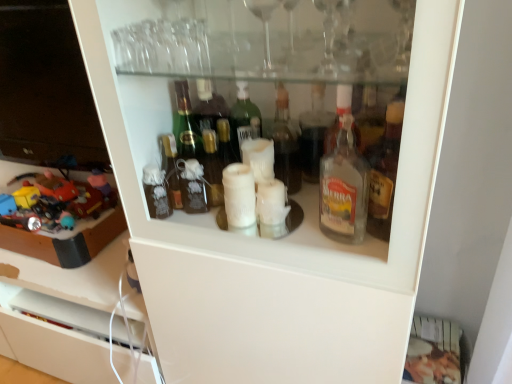
Describe the element at coordinates (61, 202) in the screenshot. I see `plastic toys at left, arranged as the first toy when viewed from the left` at that location.

You are a GUI agent. You are given a task and a screenshot of the screen. Output one action in this format:
    pyautogui.click(x=<x>, y=<y>)
    Task: Click on the plastic toys at left, positioned as the second toy in right-to-left order
    
    Given the screenshot: What is the action you would take?
    pyautogui.click(x=61, y=202)

You are a GUI agent. You are given a task and a screenshot of the screen. Output one action in this format:
    pyautogui.click(x=<x>, y=<y>)
    Task: Click on the plastic toy car at left, the 2th toy viewed from the left
    
    Given the screenshot: What is the action you would take?
    pyautogui.click(x=56, y=187)

The width and height of the screenshot is (512, 384). Describe the element at coordinates (56, 187) in the screenshot. I see `plastic toy car at left, placed as the first toy when sorted from right to left` at that location.

Image resolution: width=512 pixels, height=384 pixels. Find the location of `plastic toys at left, arranged as the first toy when viewed from the left`. plastic toys at left, arranged as the first toy when viewed from the left is located at coordinates (61, 202).

Can you confirm if plastic toy car at left, the 2th toy viewed from the left, is positioned to the right of plastic toys at left, arranged as the first toy when viewed from the left?

Yes, plastic toy car at left, the 2th toy viewed from the left, is to the right of plastic toys at left, arranged as the first toy when viewed from the left.

Is plastic toy car at left, the 2th toy viewed from the left, further to camera compared to plastic toys at left, positioned as the second toy in right-to-left order?

That is True.

Does point (49, 176) come behind point (79, 205)?

Yes, point (49, 176) is farther from viewer.

From the image's perspective, is plastic toy car at left, the 2th toy viewed from the left, above plastic toys at left, arranged as the first toy when viewed from the left?

Yes.

From a real-world perspective, is plastic toy car at left, placed as the first toy when sorted from right to left, under plastic toys at left, arranged as the first toy when viewed from the left?

No.

In terms of width, does plastic toy car at left, the 2th toy viewed from the left, look wider or thinner when compared to plastic toys at left, arranged as the first toy when viewed from the left?

In the image, plastic toy car at left, the 2th toy viewed from the left, appears to be more narrow than plastic toys at left, arranged as the first toy when viewed from the left.

Between plastic toy car at left, placed as the first toy when sorted from right to left, and plastic toys at left, arranged as the first toy when viewed from the left, which one has more height?

With more height is plastic toys at left, arranged as the first toy when viewed from the left.

Considering the sizes of plastic toy car at left, placed as the first toy when sorted from right to left, and plastic toys at left, positioned as the second toy in right-to-left order, in the image, is plastic toy car at left, placed as the first toy when sorted from right to left, bigger or smaller than plastic toys at left, positioned as the second toy in right-to-left order,?

Clearly, plastic toy car at left, placed as the first toy when sorted from right to left, is smaller in size than plastic toys at left, positioned as the second toy in right-to-left order.

Is plastic toy car at left, the 2th toy viewed from the left, completely or partially outside of plastic toys at left, positioned as the second toy in right-to-left order?

No, plastic toy car at left, the 2th toy viewed from the left, is not outside of plastic toys at left, positioned as the second toy in right-to-left order.

Is plastic toy car at left, placed as the first toy when sorted from right to left, beside plastic toys at left, positioned as the second toy in right-to-left order?

Yes, plastic toy car at left, placed as the first toy when sorted from right to left, is touching plastic toys at left, positioned as the second toy in right-to-left order.

Is plastic toy car at left, placed as the first toy when sorted from right to left, turned away from plastic toys at left, arranged as the first toy when viewed from the left?

No, plastic toys at left, arranged as the first toy when viewed from the left, is not at the back of plastic toy car at left, placed as the first toy when sorted from right to left.

Locate an element on the screen. toy below the plastic toy car at left, placed as the first toy when sorted from right to left (from the image's perspective) is located at coordinates coord(61,202).

Considering the positions of objects plastic toys at left, positioned as the second toy in right-to-left order, and plastic toy car at left, placed as the first toy when sorted from right to left, in the image provided, who is more to the right, plastic toys at left, positioned as the second toy in right-to-left order, or plastic toy car at left, placed as the first toy when sorted from right to left,?

From the viewer's perspective, plastic toy car at left, placed as the first toy when sorted from right to left, appears more on the right side.

Relative to plastic toy car at left, the 2th toy viewed from the left, is plastic toys at left, arranged as the first toy when viewed from the left, in front or behind?

plastic toys at left, arranged as the first toy when viewed from the left, is in front of plastic toy car at left, the 2th toy viewed from the left.

Does point (114, 193) come behind point (55, 182)?

No, it is in front of (55, 182).

In the scene shown: From the image's perspective, which object appears higher, plastic toys at left, arranged as the first toy when viewed from the left, or plastic toy car at left, placed as the first toy when sorted from right to left?

plastic toy car at left, placed as the first toy when sorted from right to left, from the image's perspective.

From a real-world perspective, is plastic toys at left, arranged as the first toy when viewed from the left, positioned under plastic toy car at left, placed as the first toy when sorted from right to left, based on gravity?

Indeed, from a real-world perspective, plastic toys at left, arranged as the first toy when viewed from the left, is positioned beneath plastic toy car at left, placed as the first toy when sorted from right to left.

Considering the sizes of objects plastic toys at left, arranged as the first toy when viewed from the left, and plastic toy car at left, the 2th toy viewed from the left, in the image provided, who is wider, plastic toys at left, arranged as the first toy when viewed from the left, or plastic toy car at left, the 2th toy viewed from the left,?

With larger width is plastic toys at left, arranged as the first toy when viewed from the left.

Considering the sizes of plastic toys at left, arranged as the first toy when viewed from the left, and plastic toy car at left, the 2th toy viewed from the left, in the image, is plastic toys at left, arranged as the first toy when viewed from the left, taller or shorter than plastic toy car at left, the 2th toy viewed from the left,?

In the image, plastic toys at left, arranged as the first toy when viewed from the left, appears to be taller than plastic toy car at left, the 2th toy viewed from the left.

Can you confirm if plastic toys at left, arranged as the first toy when viewed from the left, is bigger than plastic toy car at left, placed as the first toy when sorted from right to left?

Indeed, plastic toys at left, arranged as the first toy when viewed from the left, has a larger size compared to plastic toy car at left, placed as the first toy when sorted from right to left.

Is plastic toy car at left, the 2th toy viewed from the left, located within plastic toys at left, arranged as the first toy when viewed from the left?

Yes, plastic toy car at left, the 2th toy viewed from the left, is inside plastic toys at left, arranged as the first toy when viewed from the left.

Is plastic toys at left, arranged as the first toy when viewed from the left, not close to plastic toy car at left, the 2th toy viewed from the left?

No, there isn't a large distance between plastic toys at left, arranged as the first toy when viewed from the left, and plastic toy car at left, the 2th toy viewed from the left.

Is plastic toys at left, positioned as the second toy in right-to-left order, facing towards plastic toy car at left, placed as the first toy when sorted from right to left?

No, plastic toys at left, positioned as the second toy in right-to-left order, does not turn towards plastic toy car at left, placed as the first toy when sorted from right to left.

In the image, there is a plastic toy car at left, placed as the first toy when sorted from right to left. At what (x,y) coordinates should I click in order to perform the action: click on toy below it (from a real-world perspective). Please return your answer as a coordinate pair (x, y). Looking at the image, I should click on point(61,202).

Image resolution: width=512 pixels, height=384 pixels. Identify the location of toy below the plastic toy car at left, placed as the first toy when sorted from right to left (from the image's perspective). (61, 202).

I want to click on toy that appears on the right of plastic toys at left, positioned as the second toy in right-to-left order, so click(56, 187).